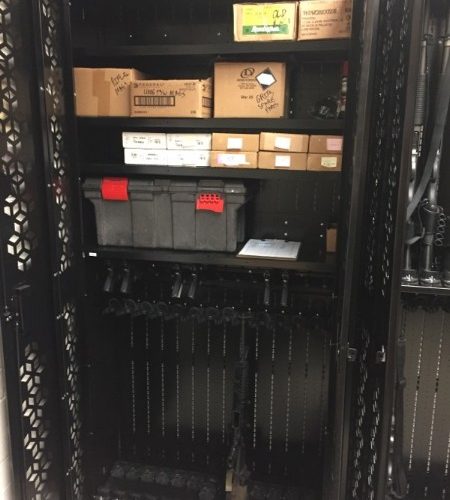
Image resolution: width=450 pixels, height=500 pixels. Find the location of `black shelf`. black shelf is located at coordinates (211, 261).